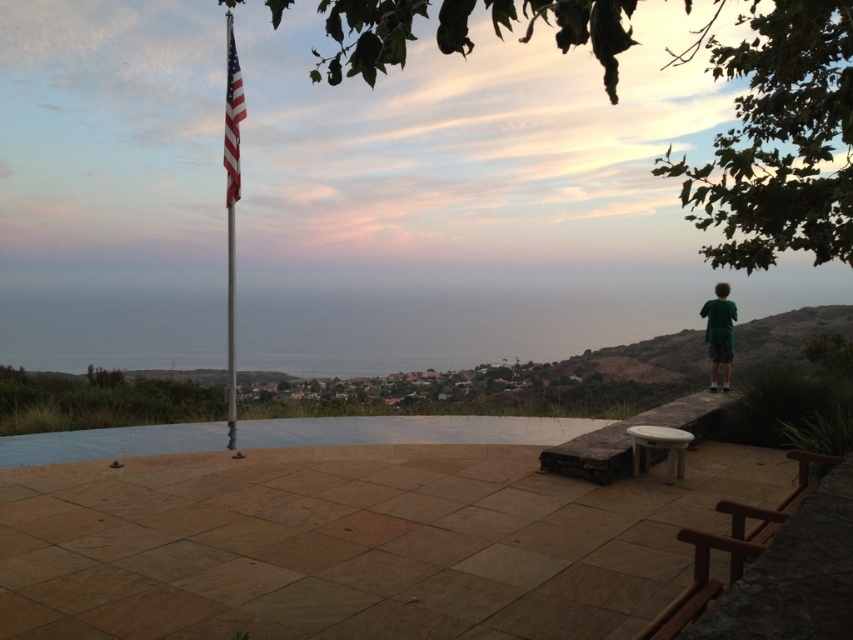
You are a photographer trying to capture the american flag at upper left and the metallic flagpole at upper left in a single shot. Based on their sizes, which object should you focus on first to ensure both are clearly visible in the frame?

The american flag at upper left is larger in size than the metallic flagpole at upper left, so you should focus on the american flag at upper left first to ensure both objects are clearly visible in the frame.